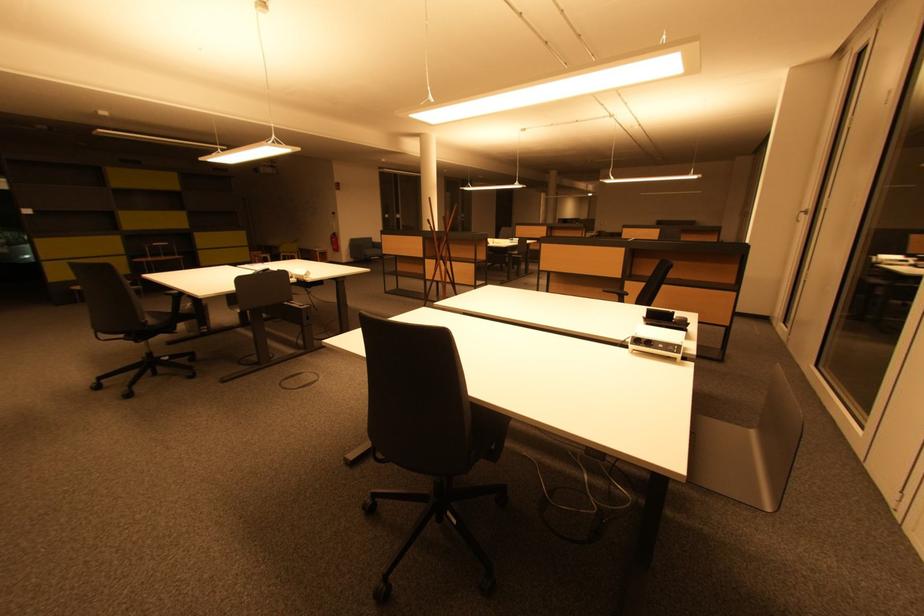
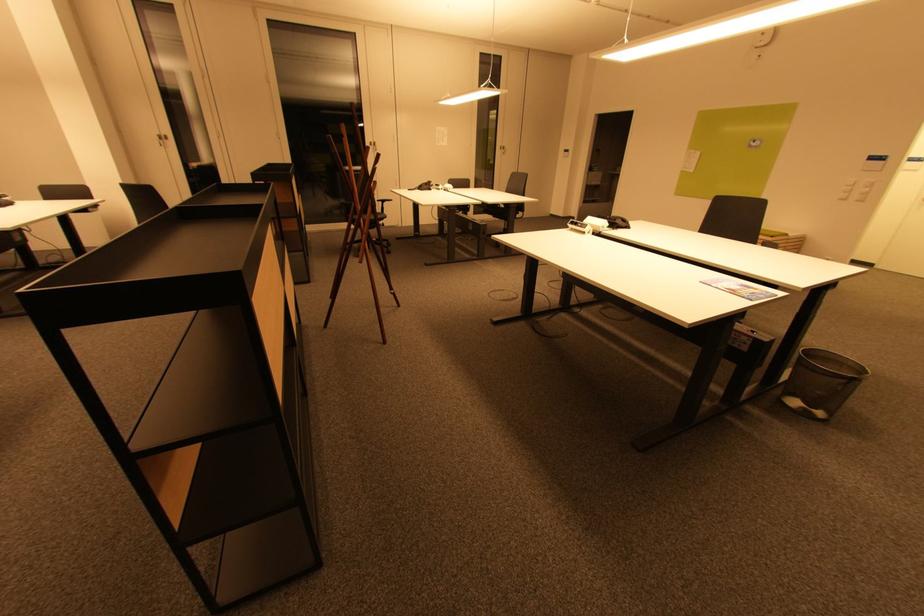
Where in the second image is the point corresponding to point (809, 214) from the first image?

(166, 140)